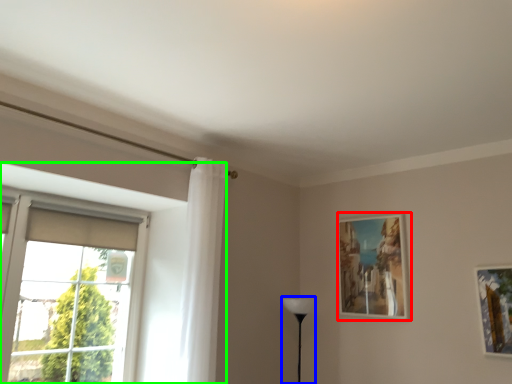
Question: Estimate the real-world distances between objects in this image. Which object is farther from picture frame (highlighted by a red box), table lamp (highlighted by a blue box) or window (highlighted by a green box)?

Choices:
 (A) table lamp
 (B) window

Answer: (B)